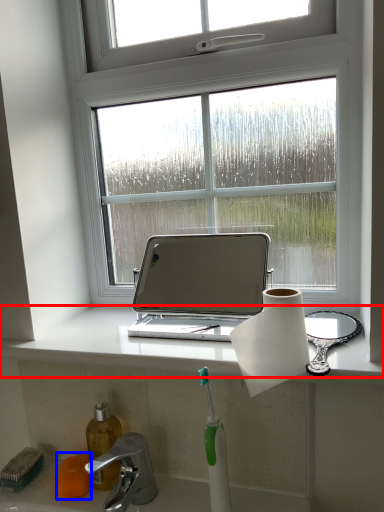
Question: Among these objects, which one is farthest to the camera, window sill (highlighted by a red box) or soap (highlighted by a blue box)?

Choices:
 (A) window sill
 (B) soap

Answer: (B)